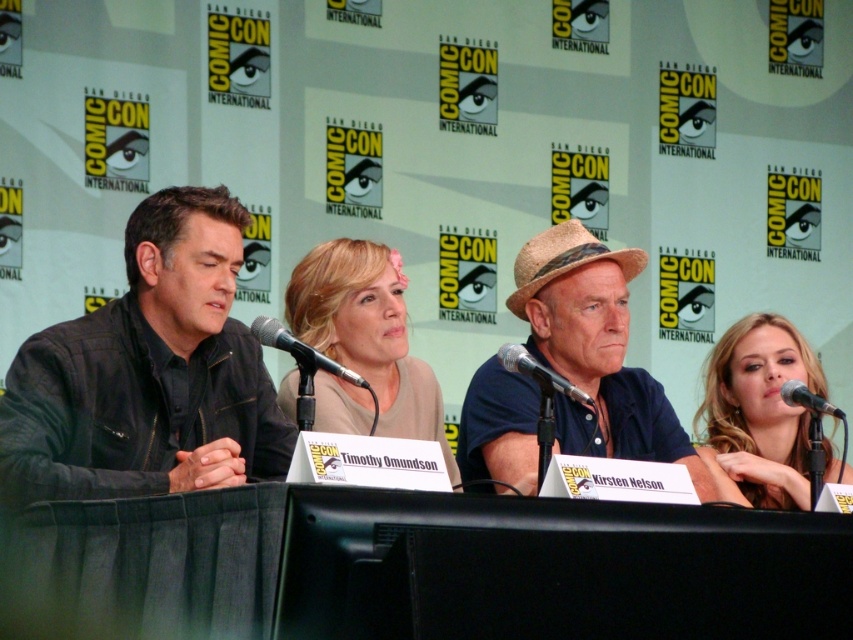
Question: Considering the real-world distances, which object is closest to the blonde hair at upper right?

Choices:
 (A) black metallic microphone at lower right
 (B) blue denim shirt at center
 (C) black fabric table at center

Answer: (A)

Question: Which point is farther to the camera?

Choices:
 (A) (361, 355)
 (B) (527, 369)
 (C) (200, 189)

Answer: (A)

Question: Does black leather jacket at left have a smaller size compared to blonde hair at upper right?

Choices:
 (A) yes
 (B) no

Answer: (A)

Question: Does blonde hair at center appear on the right side of metallic silver microphone at center?

Choices:
 (A) yes
 (B) no

Answer: (B)

Question: Is blue denim shirt at center positioned in front of metallic silver microphone at center?

Choices:
 (A) yes
 (B) no

Answer: (B)

Question: Which point is farther to the camera?

Choices:
 (A) blonde hair at center
 (B) metallic silver microphone at center
 (C) black metallic microphone at lower right
 (D) blue denim shirt at center

Answer: (D)